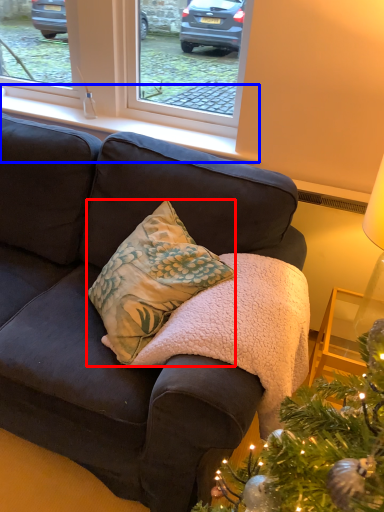
Question: Which of the following is the farthest to the observer, pillow (highlighted by a red box) or window sill (highlighted by a blue box)?

Choices:
 (A) pillow
 (B) window sill

Answer: (B)